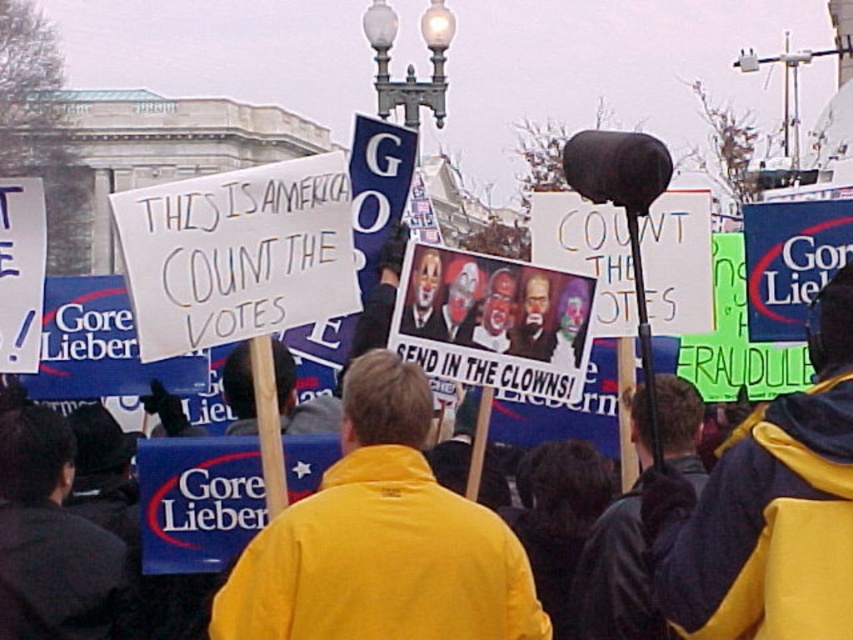
You are a photographer at the protest scene. You need to capture a photo that includes both the yellow fabric jacket at center and the yellow fabric jacket at lower right. Based on their positions, which jacket should be placed on the left side of the photo?

The yellow fabric jacket at center should be placed on the left side of the photo because it is positioned to the left of the yellow fabric jacket at lower right.

You are a photographer standing in the protest scene. You want to take a photo that includes both the point at (345, 486) and the point at (679, 550). Which point should you focus on to ensure both are in sharp focus?

You should focus on the point closer to the viewer, which is point (345, 486), because the depth of field will naturally include the farther point (679, 550) in focus as well.